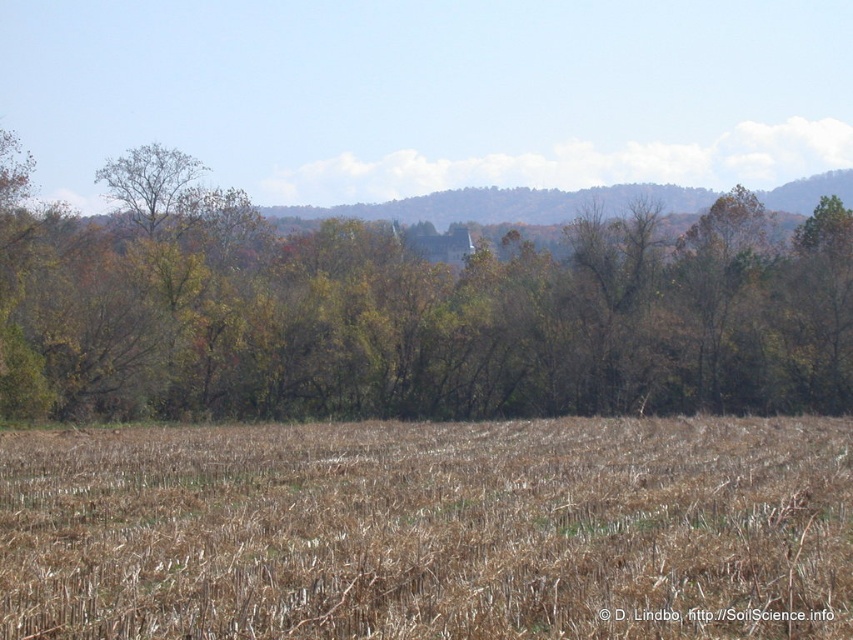
You are standing in the rural landscape and want to determine the distance between two points marked in the image. The first point is at coordinate point (251,550) and the second is at point (520,264). Based on the scene description, which point is closer to you?

Point (251,550) is closer to the camera than point (520,264).

Looking at this image, you are a hiker standing at the edge of the field. You see the brown dry grass at center and the green leafy tree at center. Which object is closer to you?

The brown dry grass at center is closer to you since it is only 26.52 meters away from the green leafy tree at center, implying the grass is in the foreground.

You are standing at the edge of the field and want to place a small garden ornament exactly at the center of the field. According to the image, where should you position it relative to the brown dry grass at center?

The brown dry grass at center is located at point (431, 531), so you should position the ornament at that coordinate relative to the brown dry grass at center.